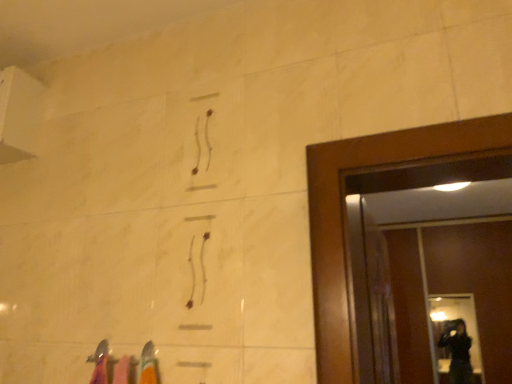
The image size is (512, 384). What do you see at coordinates (455, 332) in the screenshot?
I see `transparent glass door at right` at bounding box center [455, 332].

Locate an element on the screen. The height and width of the screenshot is (384, 512). transparent glass door at right is located at coordinates (455, 332).

Image resolution: width=512 pixels, height=384 pixels. I want to click on transparent glass screen door at right, so click(451, 291).

Describe the element at coordinates (451, 291) in the screenshot. This screenshot has width=512, height=384. I see `transparent glass screen door at right` at that location.

The height and width of the screenshot is (384, 512). Find the location of `transparent glass door at right`. transparent glass door at right is located at coordinates (455, 332).

Which object is positioned more to the left, transparent glass screen door at right or transparent glass door at right?

transparent glass door at right is more to the left.

Relative to transparent glass door at right, is transparent glass screen door at right in front or behind?

Visually, transparent glass screen door at right is located in front of transparent glass door at right.

Is point (410, 233) positioned before point (467, 360)?

No, it is not.

From the image's perspective, would you say transparent glass screen door at right is positioned over transparent glass door at right?

Yes.

From a real-world perspective, who is located higher, transparent glass screen door at right or transparent glass door at right?

transparent glass screen door at right, from a real-world perspective.

In terms of width, does transparent glass screen door at right look wider or thinner when compared to transparent glass door at right?

transparent glass screen door at right is wider than transparent glass door at right.

Can you confirm if transparent glass screen door at right is shorter than transparent glass door at right?

Incorrect, the height of transparent glass screen door at right does not fall short of that of transparent glass door at right.

Which of these two, transparent glass screen door at right or transparent glass door at right, is smaller?

Smaller between the two is transparent glass door at right.

Is transparent glass screen door at right completely or partially outside of transparent glass door at right?

Yes, transparent glass screen door at right is outside of transparent glass door at right.

Is transparent glass screen door at right not near transparent glass door at right?

transparent glass screen door at right is near transparent glass door at right, not far away.

Does transparent glass screen door at right turn towards transparent glass door at right?

Yes, transparent glass screen door at right is turned towards transparent glass door at right.

Can you tell me how much transparent glass screen door at right and transparent glass door at right differ in facing direction?

The facing directions of transparent glass screen door at right and transparent glass door at right are 6.24e-05 degrees apart.

At what (x,y) coordinates should I click in order to perform the action: click on screen door lying on the right of transparent glass door at right. Please return your answer as a coordinate pair (x, y). Looking at the image, I should click on point(451,291).

Which is more to the right, transparent glass door at right or transparent glass screen door at right?

Positioned to the right is transparent glass screen door at right.

Which object is closer to the camera taking this photo, transparent glass door at right or transparent glass screen door at right?

transparent glass screen door at right is more forward.

Considering the points (442, 303) and (421, 261), which point is behind, point (442, 303) or point (421, 261)?

The point (421, 261) is behind.

From the image's perspective, is transparent glass door at right below transparent glass screen door at right?

Yes, from the image's perspective, transparent glass door at right is below transparent glass screen door at right.

From a real-world perspective, which is physically above, transparent glass door at right or transparent glass screen door at right?

From a 3D spatial view, transparent glass screen door at right is above.

Which of these two, transparent glass door at right or transparent glass screen door at right, is wider?

With larger width is transparent glass screen door at right.

Is transparent glass door at right taller than transparent glass screen door at right?

In fact, transparent glass door at right may be shorter than transparent glass screen door at right.

Between transparent glass door at right and transparent glass screen door at right, which one has larger size?

Bigger between the two is transparent glass screen door at right.

Choose the correct answer: Is transparent glass door at right inside transparent glass screen door at right or outside it?

transparent glass door at right is enclosed within transparent glass screen door at right.

Is transparent glass door at right not close to transparent glass screen door at right?

No, transparent glass door at right is in close proximity to transparent glass screen door at right.

Is transparent glass door at right aimed at transparent glass screen door at right?

Yes.

How different are the orientations of transparent glass door at right and transparent glass screen door at right in degrees?

The angular difference between transparent glass door at right and transparent glass screen door at right is 6.24e-05 degrees.

How far apart are transparent glass door at right and transparent glass screen door at right?

transparent glass door at right is 8.22 inches away from transparent glass screen door at right.

Locate an element on the screen. The image size is (512, 384). screen door above the transparent glass door at right (from a real-world perspective) is located at coordinates (451, 291).

Find the location of a particular element. The width and height of the screenshot is (512, 384). glass door lying behind the transparent glass screen door at right is located at coordinates (455, 332).

The width and height of the screenshot is (512, 384). Find the location of `screen door on the right side of transparent glass door at right`. screen door on the right side of transparent glass door at right is located at coordinates (451, 291).